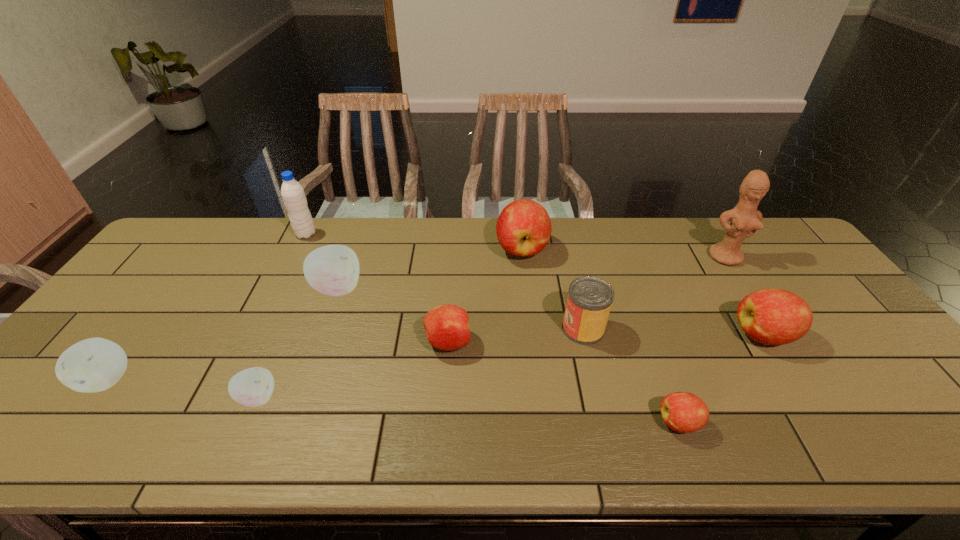
Identify the location of vacant space located 0.280m on the back of the farthest white apple. This screenshot has height=540, width=960. (362, 219).

In order to click on free spot located 0.060m on the left of the rightmost apple in this screenshot , I will do `click(712, 335)`.

You are a GUI agent. You are given a task and a screenshot of the screen. Output one action in this format:
    pyautogui.click(x=<x>, y=<y>)
    Task: Click on the vacant area located 0.380m on the back of the can
    The image size is (960, 540).
    Given the screenshot: What is the action you would take?
    pyautogui.click(x=561, y=232)

The width and height of the screenshot is (960, 540). Identify the location of free space located 0.080m on the right of the leftmost white apple. (166, 380).

You are a GUI agent. You are given a task and a screenshot of the screen. Output one action in this format:
    pyautogui.click(x=<x>, y=<y>)
    Task: Click on the vacant space located 0.260m on the left of the leftmost red apple
    
    Given the screenshot: What is the action you would take?
    pyautogui.click(x=324, y=342)

This screenshot has width=960, height=540. In order to click on free space located 0.400m on the back of the smallest white apple in this screenshot , I will do `click(312, 271)`.

This screenshot has height=540, width=960. Find the location of `vacant space situated 0.210m on the back of the eighth object from left to right`. vacant space situated 0.210m on the back of the eighth object from left to right is located at coordinates (647, 335).

You are a GUI agent. You are given a task and a screenshot of the screen. Output one action in this format:
    pyautogui.click(x=<x>, y=<y>)
    Task: Click on the figurine located in the far edge section of the desktop
    The width and height of the screenshot is (960, 540).
    Given the screenshot: What is the action you would take?
    pyautogui.click(x=745, y=219)

You are a GUI agent. You are given a task and a screenshot of the screen. Output one action in this format:
    pyautogui.click(x=<x>, y=<y>)
    Task: Click on the water bottle located at the far edge
    This screenshot has width=960, height=540.
    Given the screenshot: What is the action you would take?
    pyautogui.click(x=293, y=195)

Identify the location of apple at the far edge. (523, 228).